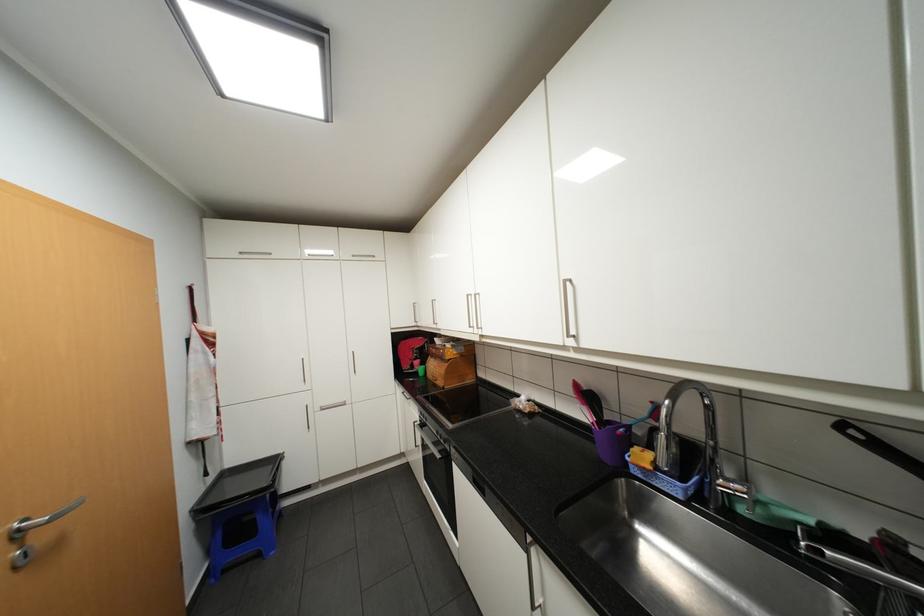
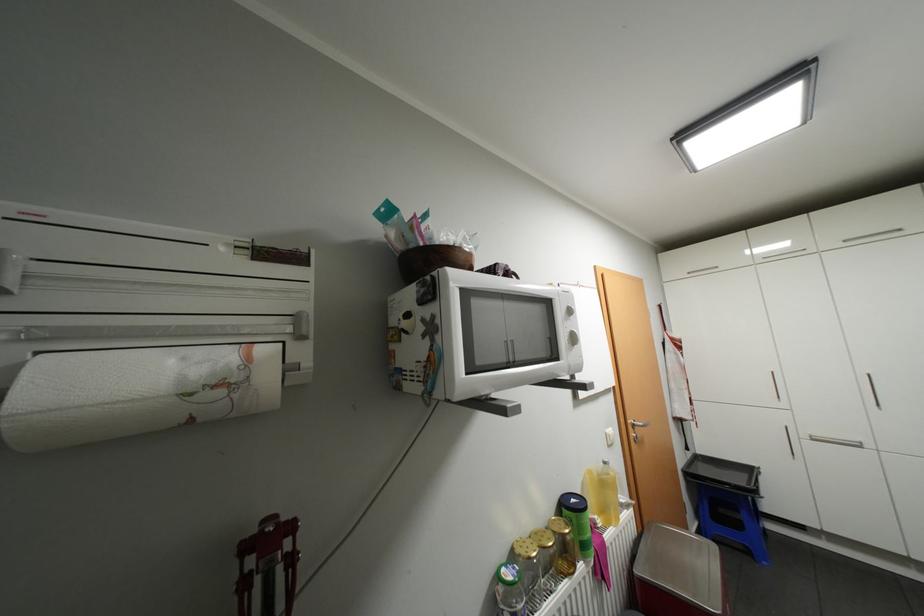
Where in the second image is the point corresponding to the point at 331,408 from the first image?

(821, 438)